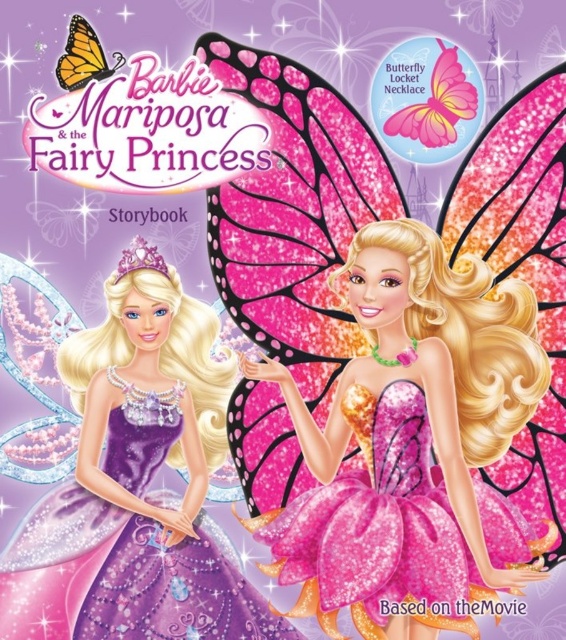
Question: Which of the following is the farthest from the observer?

Choices:
 (A) purple satin dress at left
 (B) pink glitter dress at center

Answer: (A)

Question: Is the position of pink glitter dress at center more distant than that of purple satin dress at left?

Choices:
 (A) yes
 (B) no

Answer: (B)

Question: Is pink glitter dress at center to the right of purple satin dress at left from the viewer's perspective?

Choices:
 (A) yes
 (B) no

Answer: (A)

Question: From the image, what is the correct spatial relationship of pink glitter dress at center in relation to purple satin dress at left?

Choices:
 (A) left
 (B) right

Answer: (B)

Question: Which of the following is the farthest from the observer?

Choices:
 (A) purple satin dress at left
 (B) pink glitter dress at center

Answer: (A)

Question: Which object is farther from the camera taking this photo?

Choices:
 (A) purple satin dress at left
 (B) pink glitter dress at center

Answer: (A)